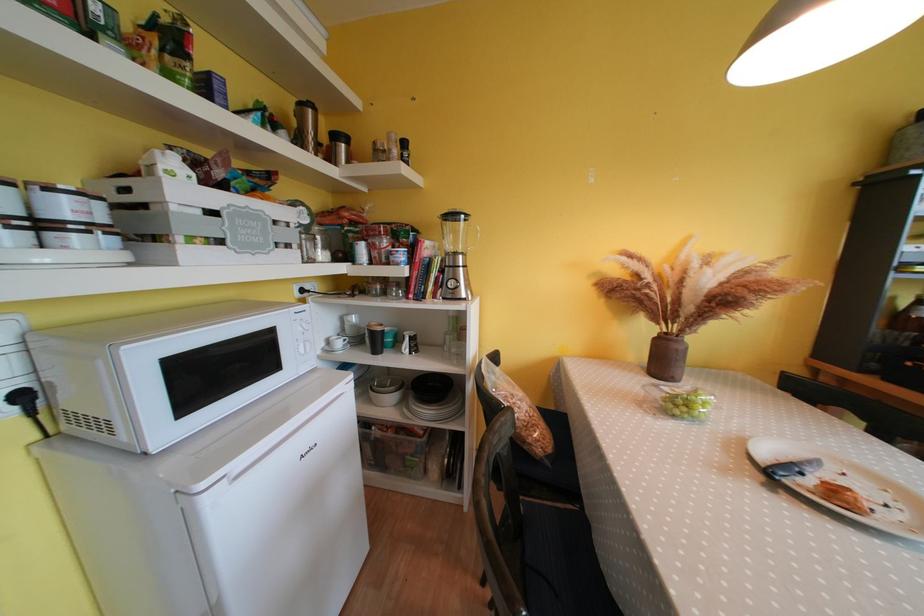
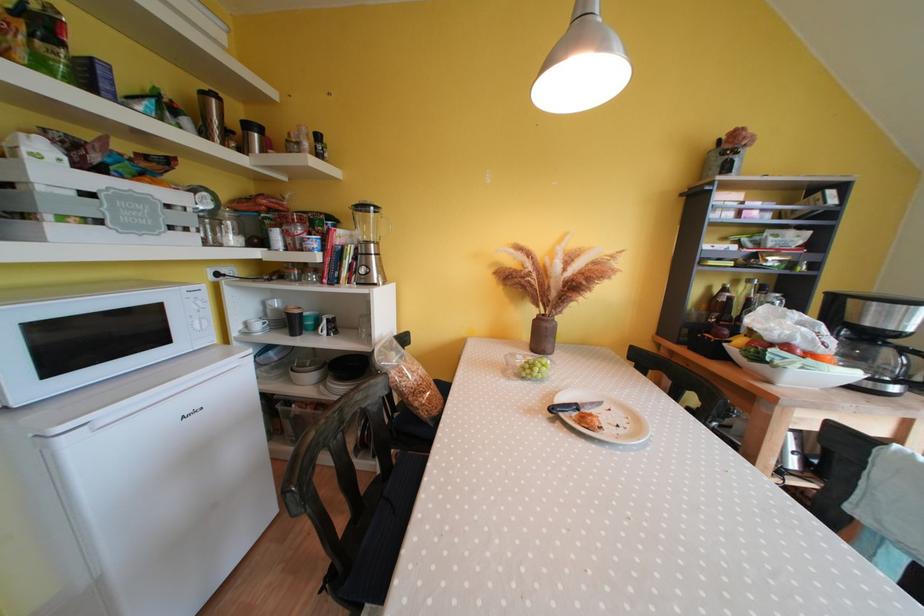
Where in the second image is the point corresponding to pixel 467 260 from the first image?

(379, 249)